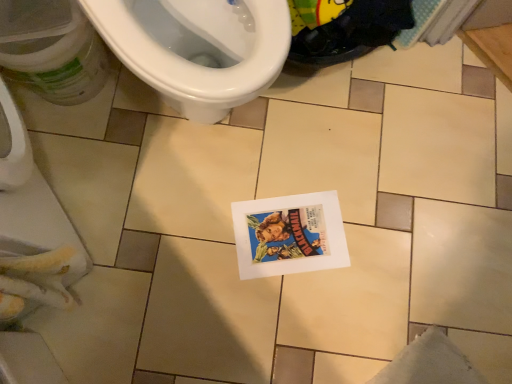
I want to click on free spot to the right of white glossy toilet at upper left, so click(337, 140).